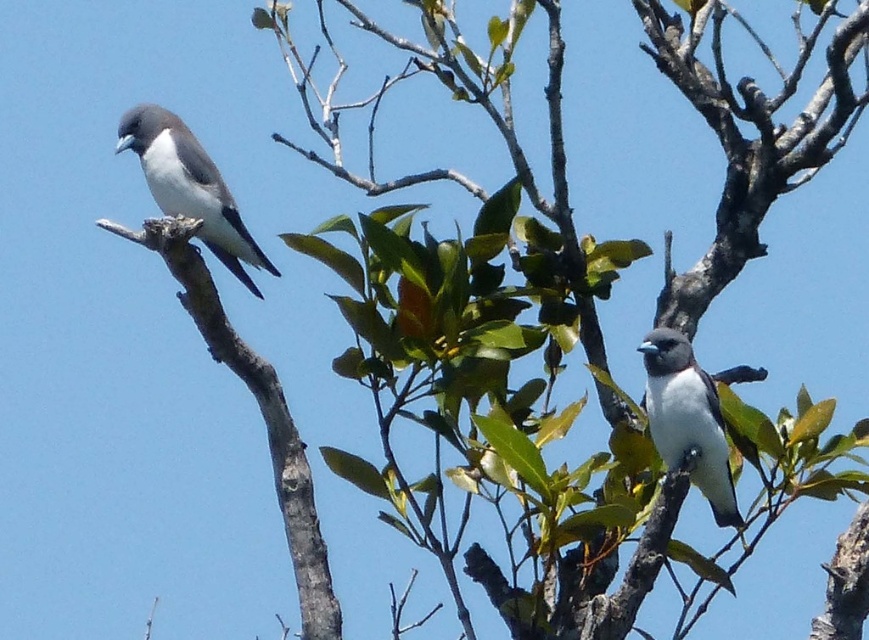
Can you confirm if white glossy bird at upper left is wider than white matte bird at center?

Yes, white glossy bird at upper left is wider than white matte bird at center.

From the picture: Is white glossy bird at upper left in front of white matte bird at center?

That is True.

What do you see at coordinates (189, 186) in the screenshot? I see `white glossy bird at upper left` at bounding box center [189, 186].

Where is `white glossy bird at upper left`? The height and width of the screenshot is (640, 869). white glossy bird at upper left is located at coordinates (189, 186).